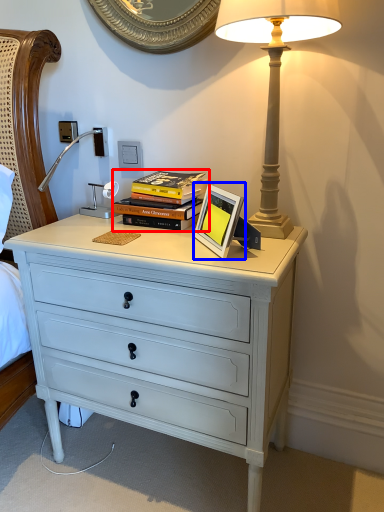
Question: Which object appears farthest to the camera in this image, book (highlighted by a red box) or picture frame (highlighted by a blue box)?

Choices:
 (A) book
 (B) picture frame

Answer: (A)